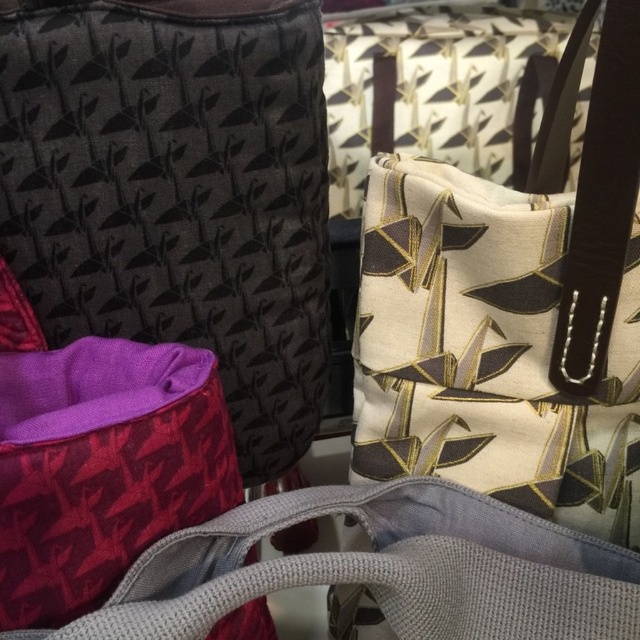
You are organizing a small display and have two fabric bags to arrange. The matte black fabric bag at center and the matte purple fabric bag at lower left. Which bag should you place in a spot that requires a thinner profile to fit?

The matte black fabric bag at center is thinner than the matte purple fabric bag at lower left, so it should be placed in the spot requiring a thinner profile.

You are organizing a display of fabric items and need to know the spatial arrangement between the matte black fabric bag at center and the matte purple fabric bag at lower left. Which one is positioned closer to the viewer?

The matte black fabric bag at center is positioned closer to the viewer than the matte purple fabric bag at lower left.